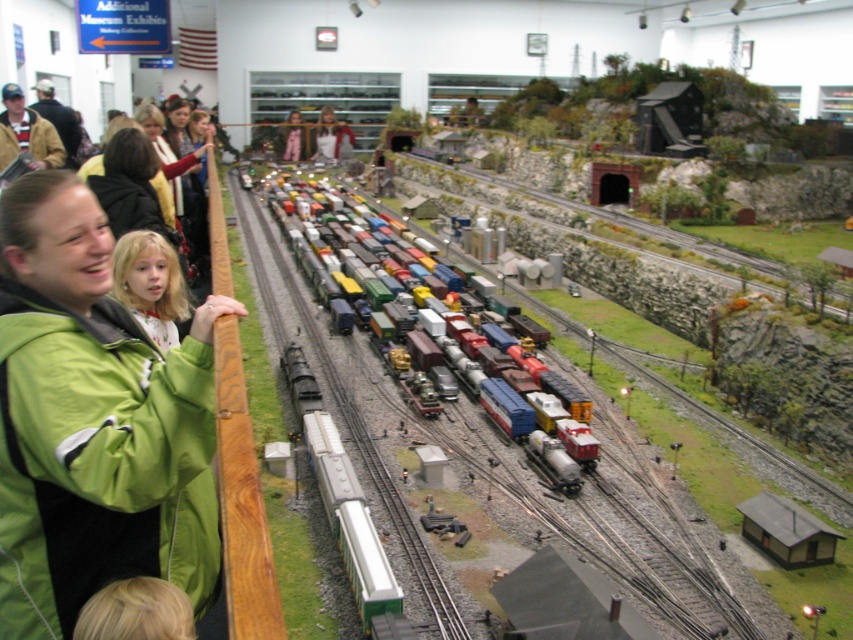
What are the exact coordinates of the khaki cotton jacket at upper left in the image?

The khaki cotton jacket at upper left is located at coordinates point (26, 131).

You are standing in front of the model train exhibit and want to take a photo of the two points mentioned. Which point, point (68, 609) or point (590, 445), will appear larger in your photo?

Point (68, 609) will appear larger in the photo because it is closer to the camera than point (590, 445).